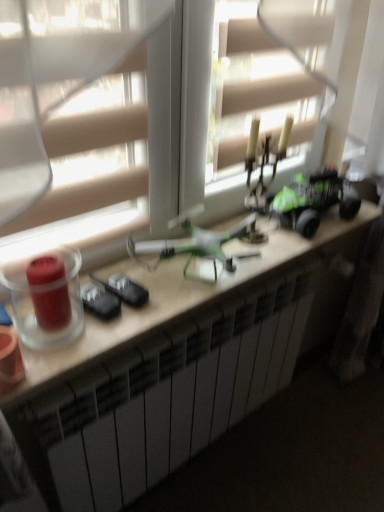
Question: In the image, is transparent glass candle at left, arranged as the 1th candle holder when viewed from the left, on the left side or the right side of white matte desk at center?

Choices:
 (A) right
 (B) left

Answer: (B)

Question: Is transparent glass candle at left, the second candle holder positioned from the right, bigger or smaller than white matte desk at center?

Choices:
 (A) small
 (B) big

Answer: (A)

Question: Which of these objects is positioned closest to the matte red candle holder at left, which ranks as the second candle holder in left-to-right order?

Choices:
 (A) transparent plastic window at center
 (B) green matte toy car at right
 (C) transparent glass candle at left, the second candle holder positioned from the right
 (D) white matte desk at center

Answer: (C)

Question: Based on their relative distances, which object is farther from the green matte toy car at right?

Choices:
 (A) transparent glass candle at left, the second candle holder positioned from the right
 (B) white matte desk at center
 (C) matte red candle holder at left, which ranks as the second candle holder in left-to-right order
 (D) transparent plastic window at center

Answer: (C)